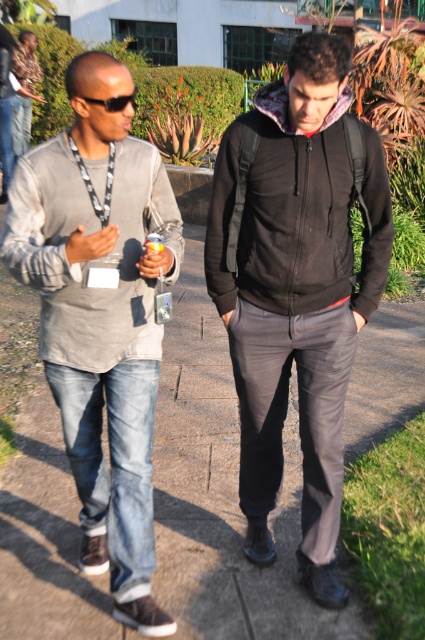
Question: Estimate the real-world distances between objects in this image. Which object is farther from the matte gray hoodie at center?

Choices:
 (A) black matte hoodie at center
 (B) gray cotton jacket at left
 (C) gray concrete pavement at center
 (D) black fleece jacket at center

Answer: (C)

Question: Is black fleece jacket at center to the left of gray cotton jacket at left from the viewer's perspective?

Choices:
 (A) yes
 (B) no

Answer: (B)

Question: Which object is positioned closest to the gray cotton jacket at left?

Choices:
 (A) matte gray hoodie at center
 (B) black fleece jacket at center

Answer: (A)

Question: Does gray concrete pavement at center appear under gray cotton jacket at left?

Choices:
 (A) no
 (B) yes

Answer: (B)

Question: Is gray concrete pavement at center below black matte hoodie at center?

Choices:
 (A) no
 (B) yes

Answer: (B)

Question: Which object is closer to the camera taking this photo?

Choices:
 (A) black fleece jacket at center
 (B) gray cotton jacket at left
 (C) gray concrete pavement at center

Answer: (B)